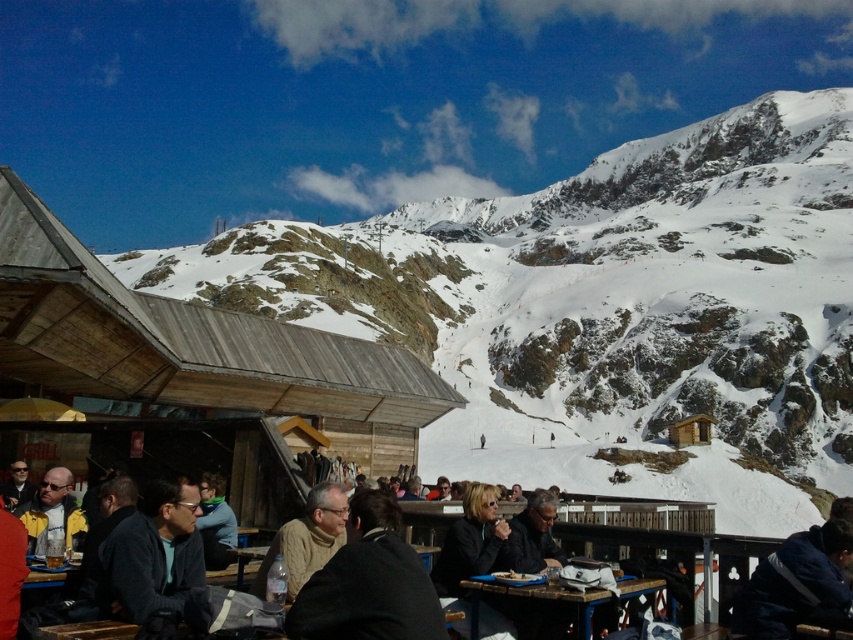
Which is more to the right, wooden hut at center or blue fabric jacket at lower right?

blue fabric jacket at lower right

Consider the image. Is wooden hut at center taller than blue fabric jacket at lower right?

Yes, wooden hut at center is taller than blue fabric jacket at lower right.

Is point (213, 356) positioned after point (764, 576)?

Yes, it is behind point (764, 576).

At what (x,y) coordinates should I click in order to perform the action: click on wooden hut at center. Please return your answer as a coordinate pair (x, y). Image resolution: width=853 pixels, height=640 pixels. Looking at the image, I should click on (194, 346).

Where is `dark gray sweater at lower left`? dark gray sweater at lower left is located at coordinates (154, 554).

From the picture: Can you confirm if dark gray sweater at lower left is positioned to the right of yellow jacket at lower left?

Indeed, dark gray sweater at lower left is positioned on the right side of yellow jacket at lower left.

Describe the element at coordinates (154, 554) in the screenshot. The height and width of the screenshot is (640, 853). I see `dark gray sweater at lower left` at that location.

You are a GUI agent. You are given a task and a screenshot of the screen. Output one action in this format:
    pyautogui.click(x=<x>, y=<y>)
    Task: Click on the dark gray sweater at lower left
    The height and width of the screenshot is (640, 853).
    Given the screenshot: What is the action you would take?
    pyautogui.click(x=154, y=554)

Is point (329, 536) positioned behind point (67, 540)?

No, it is in front of (67, 540).

Is beige sweater at center positioned in front of yellow jacket at lower left?

Yes, it is in front of yellow jacket at lower left.

Which is in front, point (321, 548) or point (67, 524)?

Point (321, 548)

Where is `beige sweater at center`? beige sweater at center is located at coordinates (306, 538).